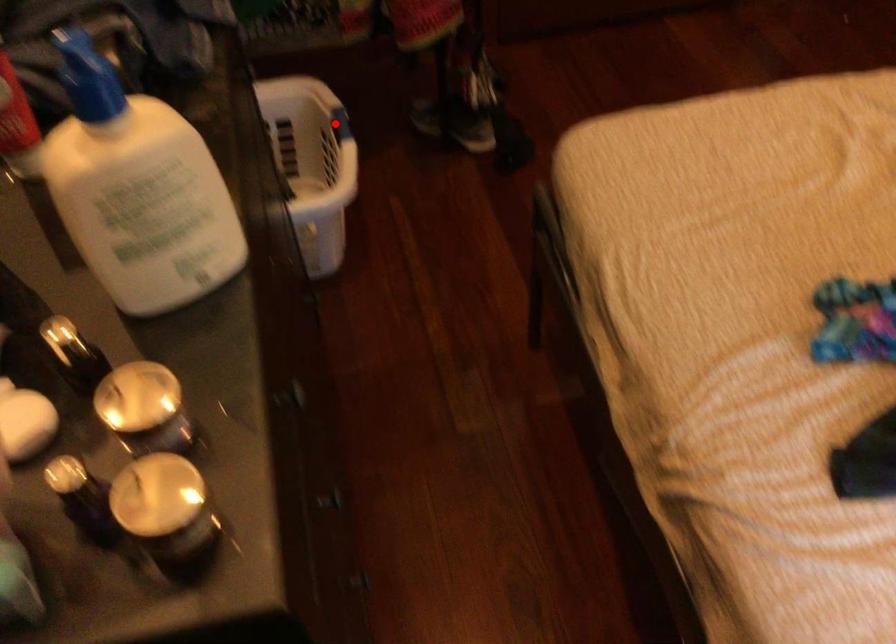
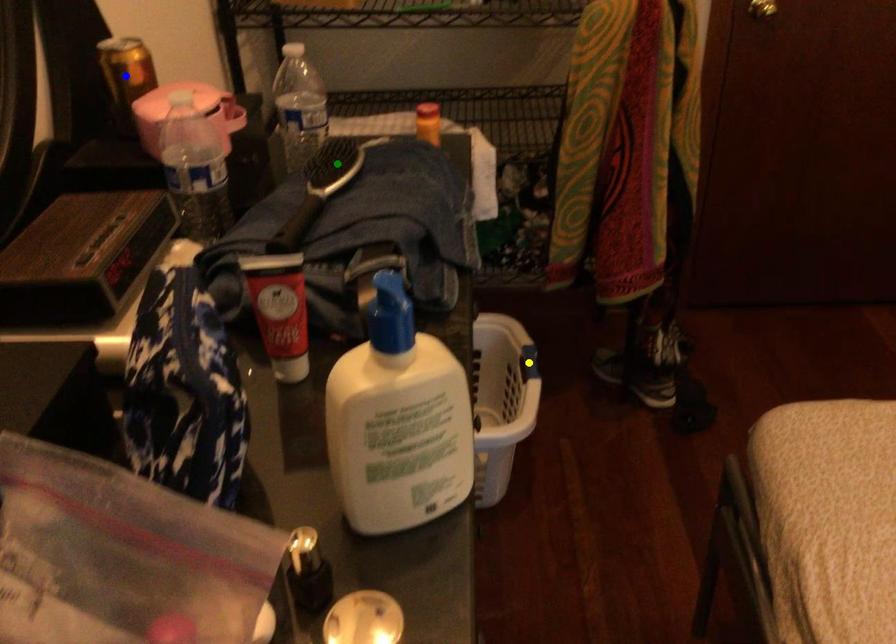
Question: I am providing you with two images of the same scene from different viewpoints. A red point is marked on the first image. You are given multiple points on the second image. Can you choose the point in image 2 that corresponds to the point in image 1?

Choices:
 (A) yellow point
 (B) green point
 (C) blue point

Answer: (A)